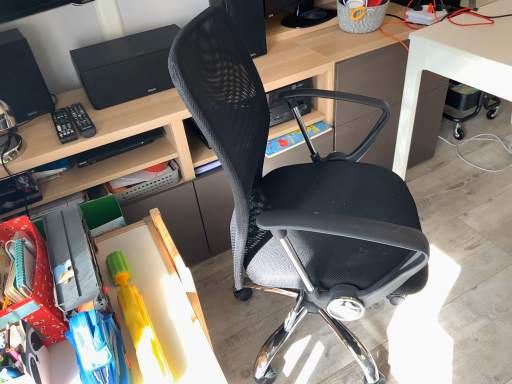
Question: Does matte plastic book at center touch black plastic remote control at left, which is the first remote control from left to right?

Choices:
 (A) yes
 (B) no

Answer: (B)

Question: Is matte plastic book at center further to camera compared to black plastic remote control at left, which is counted as the second remote control, starting from the right?

Choices:
 (A) no
 (B) yes

Answer: (B)

Question: Is black plastic remote control at left, which is the first remote control from left to right, a part of matte plastic book at center?

Choices:
 (A) no
 (B) yes

Answer: (A)

Question: From a real-world perspective, is matte plastic book at center on top of black plastic remote control at left, which is the first remote control from left to right?

Choices:
 (A) no
 (B) yes

Answer: (A)

Question: Is matte plastic book at center oriented towards black plastic remote control at left, which is the first remote control from left to right?

Choices:
 (A) no
 (B) yes

Answer: (A)

Question: From the image's perspective, is black mesh speaker at upper center, the first loudspeaker in the right-to-left sequence, positioned above or below black matte printer at upper left?

Choices:
 (A) below
 (B) above

Answer: (B)

Question: Considering the positions of black mesh speaker at upper center, marked as the 2th loudspeaker in a left-to-right arrangement, and black matte printer at upper left in the image, is black mesh speaker at upper center, marked as the 2th loudspeaker in a left-to-right arrangement, wider or thinner than black matte printer at upper left?

Choices:
 (A) wide
 (B) thin

Answer: (B)

Question: Relative to black matte printer at upper left, is black mesh speaker at upper center, the first loudspeaker in the right-to-left sequence, in front or behind?

Choices:
 (A) front
 (B) behind

Answer: (B)

Question: From a real-world perspective, is black mesh speaker at upper center, the first loudspeaker in the right-to-left sequence, above or below black matte printer at upper left?

Choices:
 (A) above
 (B) below

Answer: (A)

Question: In terms of width, does black plastic remote control at left, which is counted as the second remote control, starting from the right, look wider or thinner when compared to black mesh speaker at upper center, marked as the 2th loudspeaker in a left-to-right arrangement?

Choices:
 (A) thin
 (B) wide

Answer: (B)

Question: In terms of height, does black plastic remote control at left, which is the first remote control from left to right, look taller or shorter compared to black mesh speaker at upper center, marked as the 2th loudspeaker in a left-to-right arrangement?

Choices:
 (A) short
 (B) tall

Answer: (A)

Question: Would you say black plastic remote control at left, which is the first remote control from left to right, is to the left or to the right of black mesh speaker at upper center, the first loudspeaker in the right-to-left sequence, in the picture?

Choices:
 (A) right
 (B) left

Answer: (B)

Question: Based on their sizes in the image, would you say black plastic remote control at left, which is the first remote control from left to right, is bigger or smaller than black mesh speaker at upper center, the first loudspeaker in the right-to-left sequence?

Choices:
 (A) small
 (B) big

Answer: (A)

Question: Visually, is black plastic remote control at left, which is counted as the first remote control, starting from the right, positioned to the left or to the right of white glossy desk at lower right, which ranks as the 1th desk in right-to-left order?

Choices:
 (A) left
 (B) right

Answer: (A)

Question: Based on their sizes in the image, would you say black plastic remote control at left, which is counted as the first remote control, starting from the right, is bigger or smaller than white glossy desk at lower right, acting as the 3th desk starting from the left?

Choices:
 (A) big
 (B) small

Answer: (B)